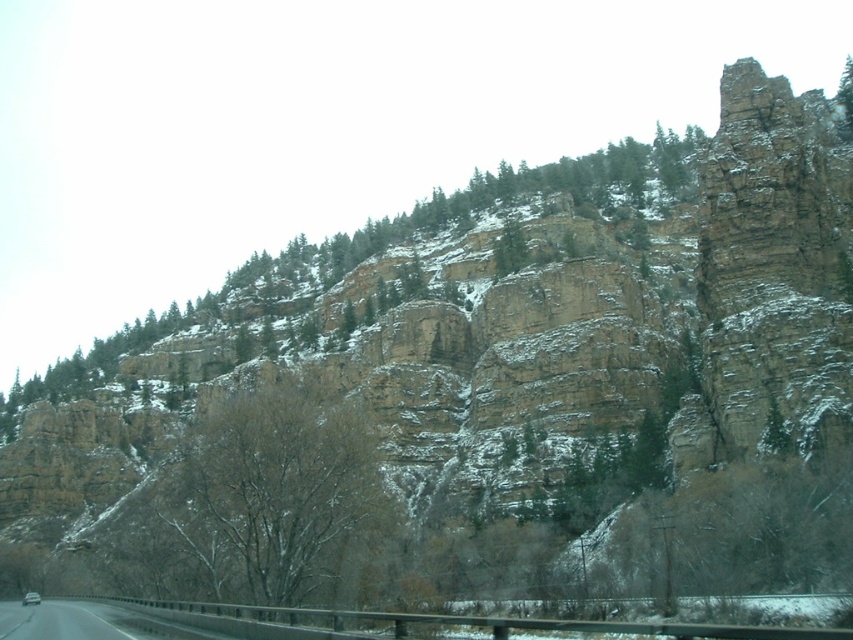
Question: Which point is farther to the camera?

Choices:
 (A) (285, 516)
 (B) (846, 122)

Answer: (B)

Question: Which point is closer to the camera taking this photo?

Choices:
 (A) (851, 125)
 (B) (268, 451)

Answer: (B)

Question: Does bare branches at center lie in front of green textured tree at upper right?

Choices:
 (A) no
 (B) yes

Answer: (B)

Question: Is bare branches at center to the left of green textured tree at upper right from the viewer's perspective?

Choices:
 (A) no
 (B) yes

Answer: (B)

Question: From the image, what is the correct spatial relationship of bare branches at center in relation to green textured tree at upper right?

Choices:
 (A) below
 (B) above

Answer: (A)